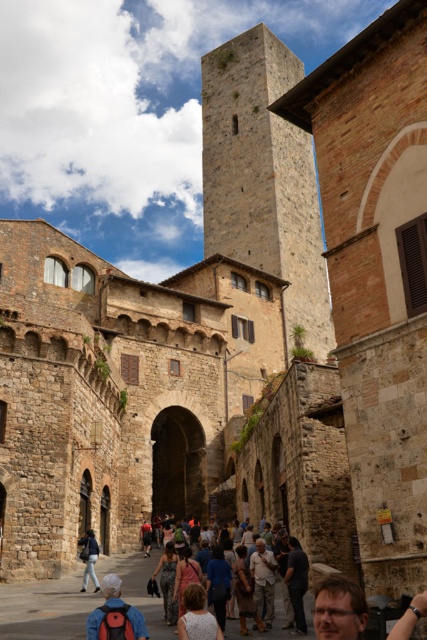
Question: In this image, where is dark gray stone crowd at center located relative to dark gray fabric at lower center?

Choices:
 (A) below
 (B) above

Answer: (A)

Question: Which point is closer to the camera?

Choices:
 (A) (160, 586)
 (B) (85, 531)
 (C) (304, 237)
 (D) (280, 612)

Answer: (D)

Question: Which point is farther to the camera?

Choices:
 (A) (181, 630)
 (B) (163, 586)

Answer: (B)

Question: Can you confirm if dark gray fabric at lower center is positioned to the left of denim jacket at center?

Choices:
 (A) yes
 (B) no

Answer: (B)

Question: Does rustic stone tower at center come behind light beige fabric shirt at center?

Choices:
 (A) yes
 (B) no

Answer: (A)

Question: Which of these objects is positioned farthest from the rustic stone tower at center?

Choices:
 (A) denim jacket at center
 (B) red backpack at lower left
 (C) dark gray fabric at lower center

Answer: (C)